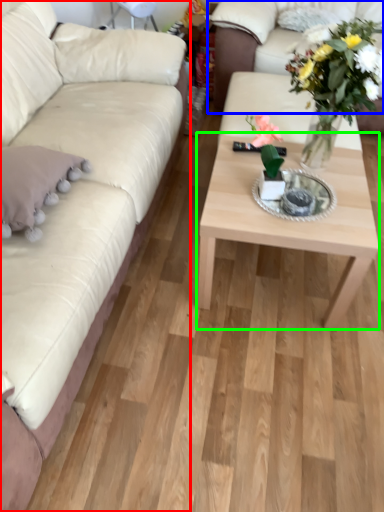
Question: Considering the real-world distances, which object is closest to studio couch (highlighted by a red box)? studio couch (highlighted by a blue box) or coffee table (highlighted by a green box).

Choices:
 (A) studio couch
 (B) coffee table

Answer: (B)